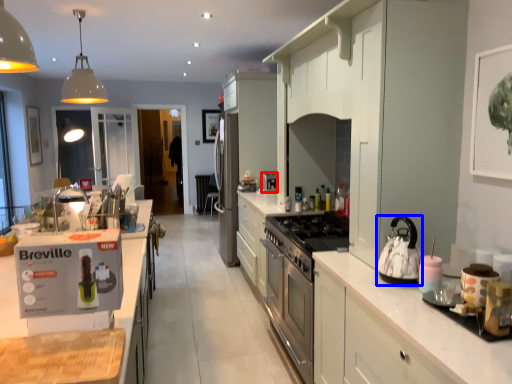
Question: Which point is further to the camera, coffee machine (highlighted by a red box) or kitchen appliance (highlighted by a blue box)?

Choices:
 (A) coffee machine
 (B) kitchen appliance

Answer: (A)